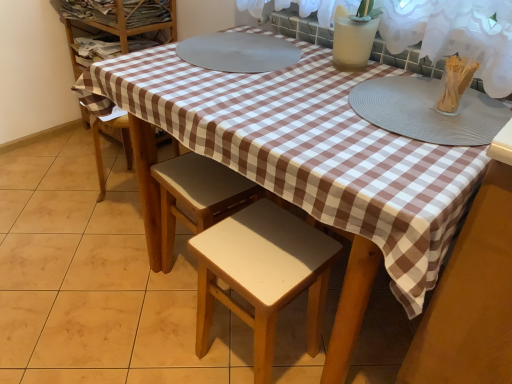
Where is `empty space that is in between light brown wood stool at center, which ranks as the 1th stool in back-to-front order, and white matte stool at lower center, which ranks as the first stool in front-to-back order`? The width and height of the screenshot is (512, 384). empty space that is in between light brown wood stool at center, which ranks as the 1th stool in back-to-front order, and white matte stool at lower center, which ranks as the first stool in front-to-back order is located at coordinates (216, 319).